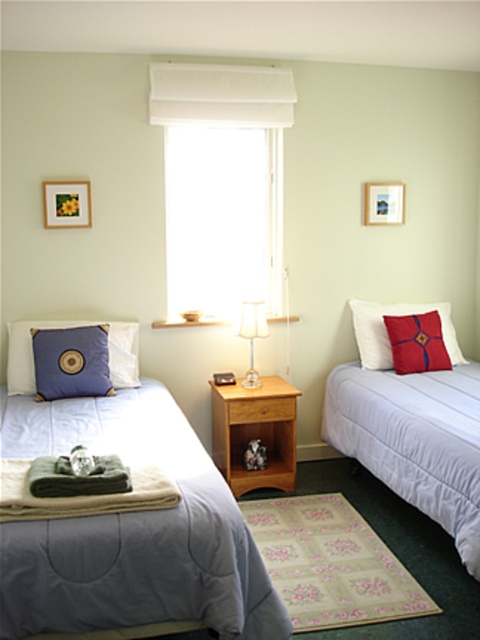
Looking at this image, you are trying to decide which pillow to use for your neck support. Considering their heights, which one between the matte blue pillow at left and the red velvet cushion at right would be better for supporting your neck?

The matte blue pillow at left is much taller than the red velvet cushion at right, so it would provide better neck support due to its greater height.

You are standing at the center of the room and want to move to the white soft bed at right. Based on the coordinates provided, in which general direction should you walk? Please choose from the options below. A. Towards the left wall B. Towards the right wall C. Towards the front wall D. Towards the back wall

The white soft bed at right is located at coordinates point (412, 481). Since the coordinate system typically places (0, 0) at the bottom left corner, a higher x value means moving right, and a higher y value means moving up. Since you are at the center, moving towards the right wall would increase the x coordinate. Therefore, the correct direction is B. Towards the right wall.

You are trying to decide whether to place a new decorative pillow on the light blue quilted blanket at left or the white fabric lamp at center. Based on their sizes, which object can better accommodate a larger decorative pillow?

The light blue quilted blanket at left is bigger than the white fabric lamp at center, so it can better accommodate a larger decorative pillow.